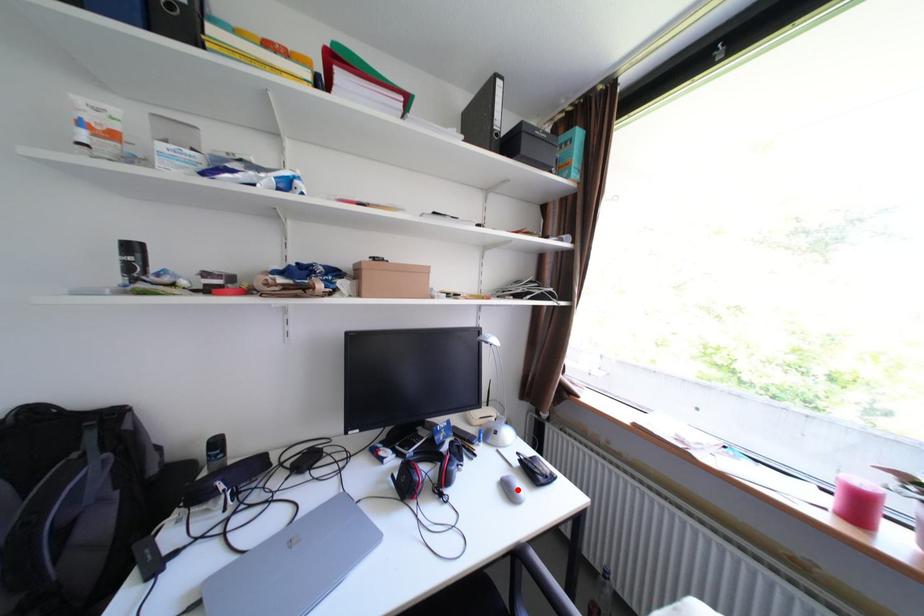
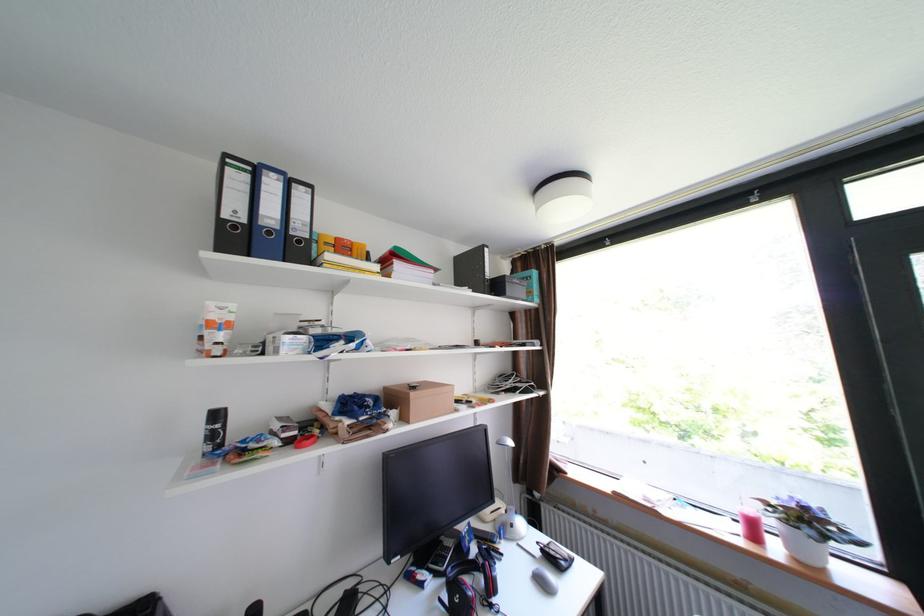
In the second image, find the point that corresponds to the highlighted location in the first image.

(552, 583)